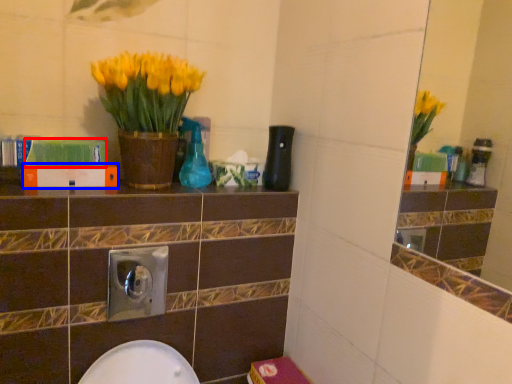
Question: Which object appears closest to the camera in this image, book (highlighted by a red box) or book (highlighted by a blue box)?

Choices:
 (A) book
 (B) book

Answer: (A)